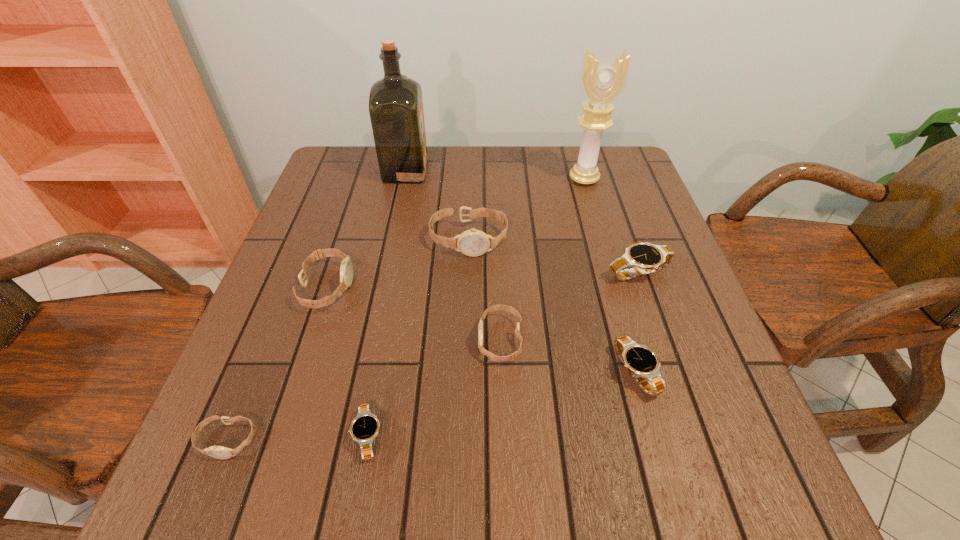
At what (x,y) coordinates should I click in order to perform the action: click on the leftmost black watch. Please return your answer as a coordinate pair (x, y). The height and width of the screenshot is (540, 960). Looking at the image, I should click on (365, 426).

Where is `the third watch from left to right`? The image size is (960, 540). the third watch from left to right is located at coordinates (365, 426).

This screenshot has height=540, width=960. I want to click on free point located 0.380m on the label of the liquor, so click(563, 171).

I want to click on free location located 0.330m on the front-facing side of the award, so click(612, 276).

This screenshot has height=540, width=960. In order to click on free point located 0.310m on the face of the seventh shortest object in this screenshot , I will do `click(465, 379)`.

The width and height of the screenshot is (960, 540). Find the location of `vacant space situated on the face of the sixth shortest object`. vacant space situated on the face of the sixth shortest object is located at coordinates (408, 287).

Where is `vacant space located 0.230m on the back of the biggest black watch`? This screenshot has height=540, width=960. vacant space located 0.230m on the back of the biggest black watch is located at coordinates (613, 198).

The image size is (960, 540). In order to click on free spot located on the face of the third biggest beige watch in this screenshot , I will do `click(324, 340)`.

The image size is (960, 540). Find the location of `free space located 0.200m on the face of the third biggest beige watch`. free space located 0.200m on the face of the third biggest beige watch is located at coordinates (372, 340).

The image size is (960, 540). In order to click on vacant space positioned 0.200m on the face of the third biggest beige watch in this screenshot , I will do `click(372, 340)`.